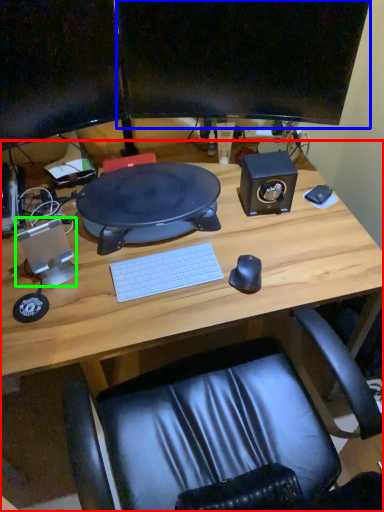
Question: Estimate the real-world distances between objects in this image. Which object is closer to desk (highlighted by a red box), computer monitor (highlighted by a blue box) or speaker (highlighted by a green box)?

Choices:
 (A) computer monitor
 (B) speaker

Answer: (B)